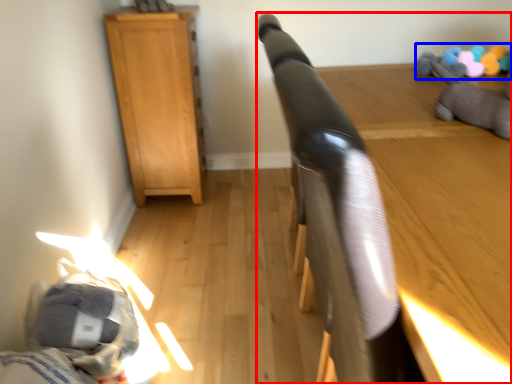
Question: Which of the following is the closest to the observer, furniture (highlighted by a red box) or toy (highlighted by a blue box)?

Choices:
 (A) furniture
 (B) toy

Answer: (A)